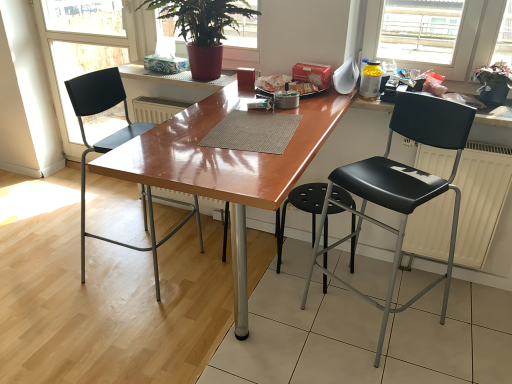
Question: From the image's perspective, is black plastic chair at left, the 1th chair when ordered from left to right, located above or below matte black chair at left?

Choices:
 (A) below
 (B) above

Answer: (A)

Question: Considering the positions of black plastic chair at left, which is counted as the second chair, starting from the right, and matte black chair at left in the image, is black plastic chair at left, which is counted as the second chair, starting from the right, taller or shorter than matte black chair at left?

Choices:
 (A) short
 (B) tall

Answer: (A)

Question: Which is nearer to the green leafy plant at upper center, arranged as the second houseplant when viewed from the right?

Choices:
 (A) glossy wood desk at center
 (B) black leather chair at right, the second chair from the left
 (C) green leafy plant at upper right, which is the 2th houseplant in left-to-right order
 (D) matte black chair at left
 (E) white matte radiator at right

Answer: (A)

Question: Estimate the real-world distances between objects in this image. Which object is farther from the red cardboard box at upper center?

Choices:
 (A) matte black chair at left
 (B) black leather chair at right, marked as the first chair in a right-to-left arrangement
 (C) yellow translucent bottle at upper right
 (D) black plastic chair at left, which is counted as the second chair, starting from the right
 (E) glossy wood desk at center

Answer: (A)